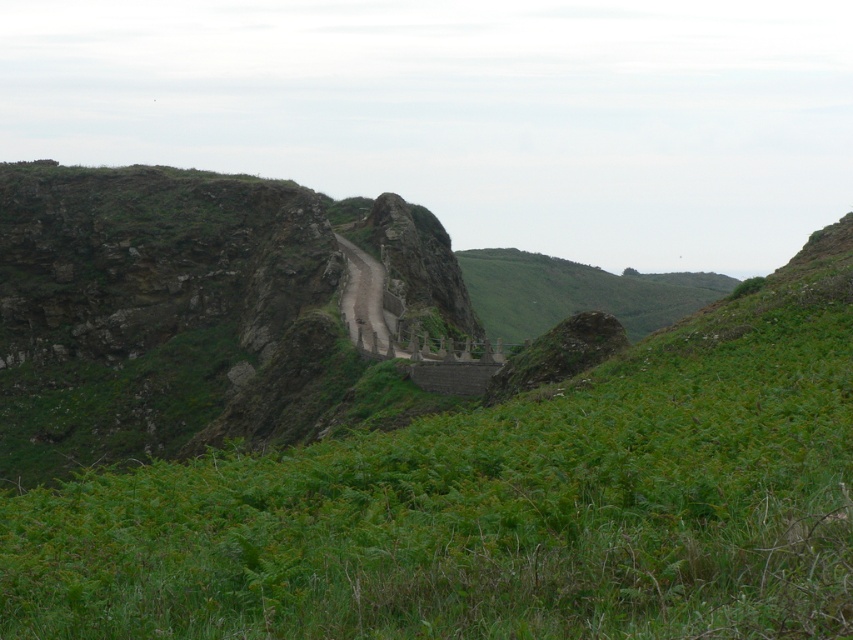
Does green leafy grass at center have a lesser height compared to dull gray stone at center?

Correct, green leafy grass at center is not as tall as dull gray stone at center.

I want to click on green leafy grass at center, so click(x=498, y=504).

The width and height of the screenshot is (853, 640). What are the coordinates of `green leafy grass at center` in the screenshot? It's located at (498, 504).